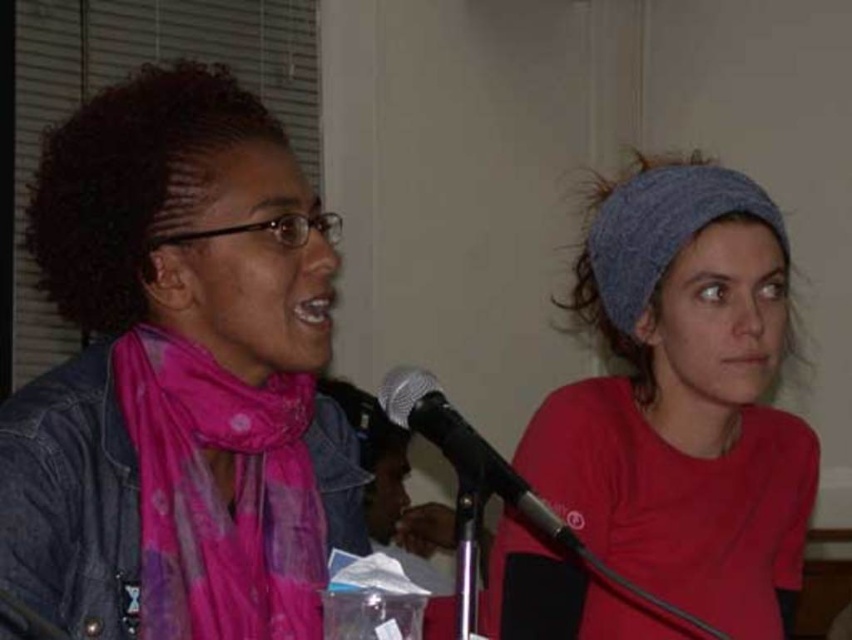
Question: Does pink fabric scarf at left have a smaller size compared to black metallic microphone at center?

Choices:
 (A) yes
 (B) no

Answer: (B)

Question: Which point appears closest to the camera in this image?

Choices:
 (A) (214, 547)
 (B) (448, 403)
 (C) (668, 598)

Answer: (A)

Question: Can you confirm if pink fabric scarf at left is positioned to the left of red cotton t-shirt at center?

Choices:
 (A) yes
 (B) no

Answer: (A)

Question: Which object is positioned farthest from the pink fabric scarf at left?

Choices:
 (A) pink sheer scarf at left
 (B) black metallic microphone at center
 (C) red cotton t-shirt at center

Answer: (C)

Question: Can you confirm if pink sheer scarf at left is positioned above black metallic microphone at center?

Choices:
 (A) yes
 (B) no

Answer: (A)

Question: Which object is farther from the camera taking this photo?

Choices:
 (A) pink sheer scarf at left
 (B) red cotton t-shirt at center
 (C) pink fabric scarf at left

Answer: (B)